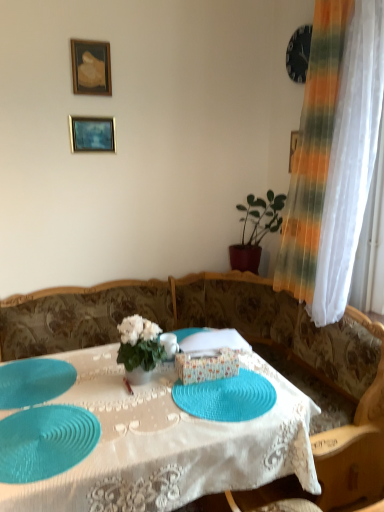
At what (x,y) coordinates should I click in order to perform the action: click on vacant space to the right of white fabric flower at center. Please return your answer as a coordinate pair (x, y). This screenshot has width=384, height=512. Looking at the image, I should click on (192, 386).